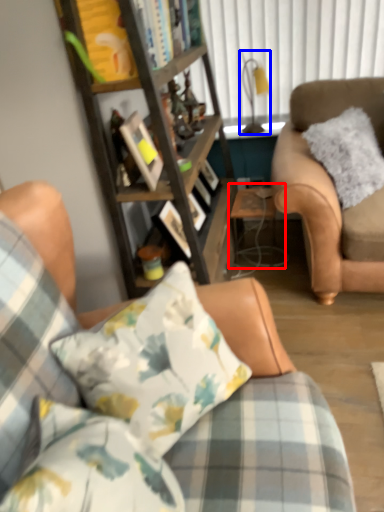
Question: Among these objects, which one is farthest to the camera, table (highlighted by a red box) or lamp (highlighted by a blue box)?

Choices:
 (A) table
 (B) lamp

Answer: (B)